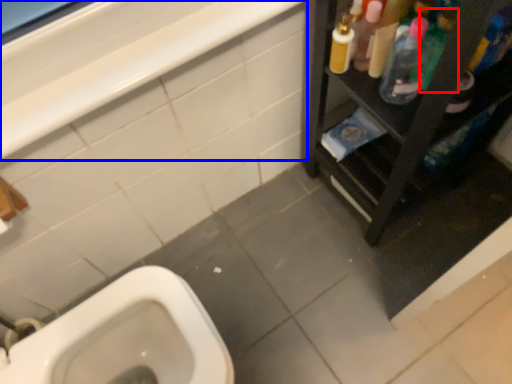
Question: Among these objects, which one is nearest to the camera, cleaning product (highlighted by a red box) or balustrade (highlighted by a blue box)?

Choices:
 (A) cleaning product
 (B) balustrade

Answer: (B)